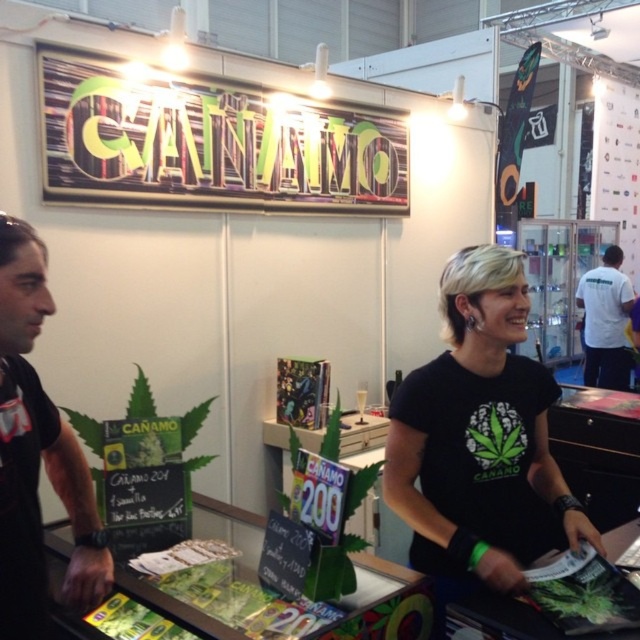
Question: Can you confirm if black matte t-shirt at center is bigger than white t-shirt at right?

Choices:
 (A) no
 (B) yes

Answer: (A)

Question: Which object is farther from the camera taking this photo?

Choices:
 (A) black matte t-shirt at left
 (B) white t-shirt at right
 (C) black matte t-shirt at center

Answer: (B)

Question: Based on their relative distances, which object is nearer to the black matte t-shirt at center?

Choices:
 (A) white t-shirt at right
 (B) black matte t-shirt at left

Answer: (B)

Question: Which object is positioned farthest from the black matte t-shirt at center?

Choices:
 (A) white t-shirt at right
 (B) black matte t-shirt at left

Answer: (A)

Question: Does black matte t-shirt at left appear under white t-shirt at right?

Choices:
 (A) yes
 (B) no

Answer: (A)

Question: Can you confirm if black matte t-shirt at left is wider than white t-shirt at right?

Choices:
 (A) no
 (B) yes

Answer: (A)